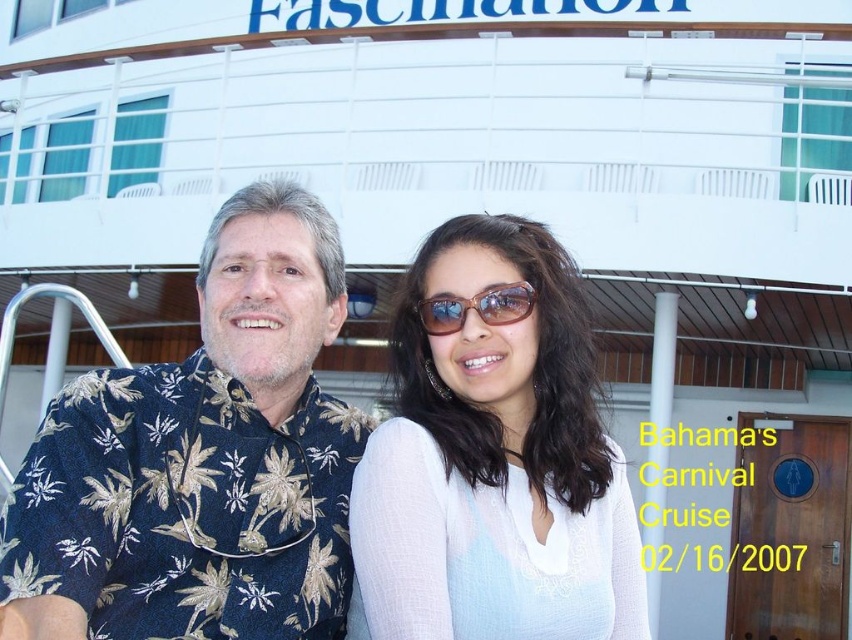
You are a photographer taking a picture of two people in front of a cruise ship. You notice the blue floral shirt at center and the white matte sunglasses at center. Which object is positioned more to the left?

The blue floral shirt at center is positioned to the left of the white matte sunglasses at center.

What is the exact coordinate of the white matte sunglasses at center?

The white matte sunglasses at center is located at point (494, 456).